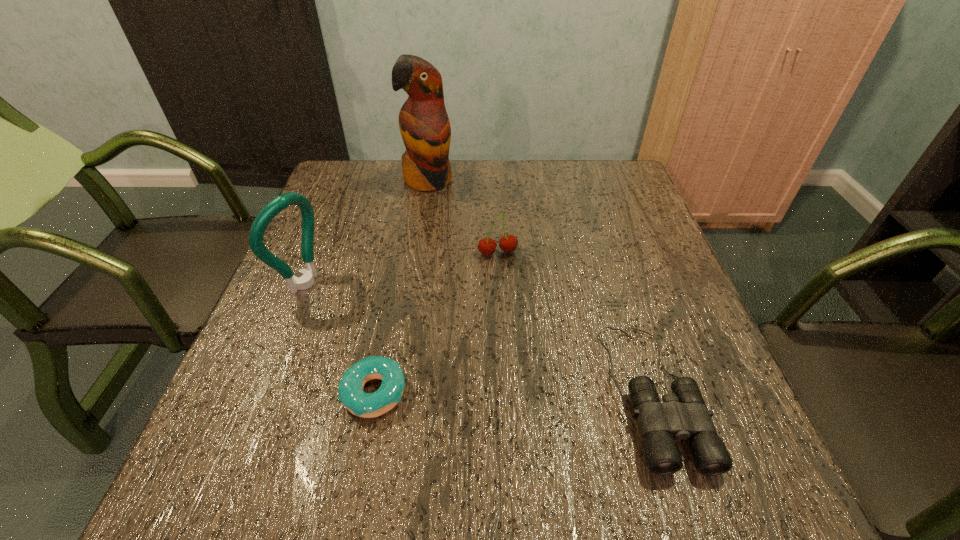
What are the coordinates of `vacant space situated 0.170m on the surface of the second farthest object` in the screenshot? It's located at (516, 313).

I want to click on blank space located on the surface of the second farthest object, so tap(526, 347).

Where is `vacant area located on the surface of the second farthest object`? vacant area located on the surface of the second farthest object is located at coordinates (516, 313).

At what (x,y) coordinates should I click in order to perform the action: click on free location located 0.340m at the jaws of the leftmost object. Please return your answer as a coordinate pair (x, y). The height and width of the screenshot is (540, 960). Looking at the image, I should click on (446, 360).

The height and width of the screenshot is (540, 960). Find the location of `free space located at the jaws of the leftmost object`. free space located at the jaws of the leftmost object is located at coordinates (464, 369).

Identify the location of vacant space located at the jaws of the leftmost object. Image resolution: width=960 pixels, height=540 pixels. (455, 364).

Identify the location of free space located 0.050m on the face of the parrot. (438, 205).

Find the location of a particular element. Image resolution: width=960 pixels, height=540 pixels. vacant position located 0.290m on the face of the parrot is located at coordinates (462, 260).

At what (x,y) coordinates should I click in order to perform the action: click on blank space located 0.230m on the face of the parrot. Please return your answer as a coordinate pair (x, y). Image resolution: width=960 pixels, height=540 pixels. Looking at the image, I should click on (455, 245).

The width and height of the screenshot is (960, 540). Find the location of `object situated at the far edge`. object situated at the far edge is located at coordinates (424, 125).